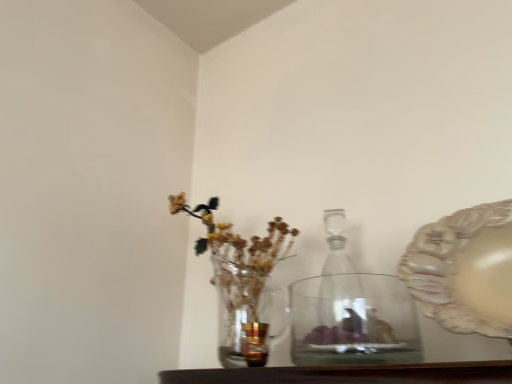
This screenshot has width=512, height=384. What do you see at coordinates (254, 343) in the screenshot?
I see `gold metallic candle holder at center` at bounding box center [254, 343].

At what (x,y) coordinates should I click in order to perform the action: click on clear glass vase at left. Please return your answer as a coordinate pair (x, y). The image size is (512, 384). Looking at the image, I should click on (242, 277).

What do you see at coordinates (343, 309) in the screenshot? I see `transparent glass bottle at center` at bounding box center [343, 309].

What is the approximate width of transparent glass bottle at center?

transparent glass bottle at center is 2.20 inches wide.

What do you see at coordinates (353, 321) in the screenshot? The image size is (512, 384). I see `transparent glass vase at center` at bounding box center [353, 321].

Locate an element on the screen. The height and width of the screenshot is (384, 512). gold metallic candle holder at center is located at coordinates (254, 343).

Are transparent glass vase at center and matte beige platter at right far apart?

No, transparent glass vase at center is in close proximity to matte beige platter at right.

Is transparent glass vase at center positioned in front of matte beige platter at right?

No.

Considering the relative sizes of transparent glass vase at center and matte beige platter at right in the image provided, is transparent glass vase at center wider than matte beige platter at right?

Correct, the width of transparent glass vase at center exceeds that of matte beige platter at right.

From the image's perspective, does gold metallic candle holder at center appear higher than matte beige platter at right?

No, from the image's perspective, gold metallic candle holder at center is not on top of matte beige platter at right.

In the scene shown: From a real-world perspective, which is physically above, gold metallic candle holder at center or matte beige platter at right?

matte beige platter at right, from a real-world perspective.

From the picture: Considering the sizes of objects gold metallic candle holder at center and matte beige platter at right in the image provided, who is thinner, gold metallic candle holder at center or matte beige platter at right?

Thinner between the two is gold metallic candle holder at center.

Are gold metallic candle holder at center and matte beige platter at right far apart?

No, gold metallic candle holder at center is not far from matte beige platter at right.

Can you confirm if transparent glass bottle at center is taller than transparent glass vase at center?

Indeed, transparent glass bottle at center has a greater height compared to transparent glass vase at center.

Based on their sizes in the image, would you say transparent glass bottle at center is bigger or smaller than transparent glass vase at center?

In the image, transparent glass bottle at center appears to be smaller than transparent glass vase at center.

Is the surface of transparent glass bottle at center in direct contact with transparent glass vase at center?

Yes, transparent glass bottle at center is beside transparent glass vase at center.

Looking at this image, which object is further away from the camera taking this photo, transparent glass bottle at center or transparent glass vase at center?

Positioned behind is transparent glass bottle at center.

From the image's perspective, would you say gold metallic candle holder at center is positioned over transparent glass bottle at center?

No.

From a real-world perspective, is gold metallic candle holder at center below transparent glass bottle at center?

Indeed, from a real-world perspective, gold metallic candle holder at center is positioned beneath transparent glass bottle at center.

Considering the relative sizes of gold metallic candle holder at center and transparent glass bottle at center in the image provided, is gold metallic candle holder at center taller than transparent glass bottle at center?

No.

Is transparent glass bottle at center wider or thinner than clear glass vase at left?

Considering their sizes, transparent glass bottle at center looks slimmer than clear glass vase at left.

Considering their positions, is transparent glass bottle at center located in front of or behind clear glass vase at left?

transparent glass bottle at center is positioned farther from the viewer than clear glass vase at left.

From a real-world perspective, relative to clear glass vase at left, is transparent glass bottle at center vertically above or below?

Clearly, from a real-world perspective, transparent glass bottle at center is below clear glass vase at left.

Is transparent glass bottle at center next to clear glass vase at left and touching it?

No, transparent glass bottle at center is not in contact with clear glass vase at left.

Does clear glass vase at left appear on the left side of transparent glass bottle at center?

Yes, clear glass vase at left is to the left of transparent glass bottle at center.

Are clear glass vase at left and transparent glass bottle at center far apart?

No.

How different are the orientations of clear glass vase at left and transparent glass bottle at center in degrees?

The angular difference between clear glass vase at left and transparent glass bottle at center is 0.57 degrees.

From a real-world perspective, between clear glass vase at left and transparent glass bottle at center, who is vertically lower?

transparent glass bottle at center, from a real-world perspective.

You are a GUI agent. You are given a task and a screenshot of the screen. Output one action in this format:
    pyautogui.click(x=<x>, y=<y>)
    Task: Click on the vase below the clear glass vase at left (from a real-world perspective)
    The width and height of the screenshot is (512, 384).
    Given the screenshot: What is the action you would take?
    pyautogui.click(x=353, y=321)

How many degrees apart are the facing directions of transparent glass vase at center and clear glass vase at left?

0.571 degrees separate the facing orientations of transparent glass vase at center and clear glass vase at left.

Considering the points (293, 303) and (271, 221), which point is behind, point (293, 303) or point (271, 221)?

Point (293, 303)

Is transparent glass vase at center looking in the opposite direction of clear glass vase at left?

No, transparent glass vase at center is not facing away from clear glass vase at left.

Where is `vase that appears below the matte beige platter at right (from a real-world perspective)`? The image size is (512, 384). vase that appears below the matte beige platter at right (from a real-world perspective) is located at coordinates (353, 321).

Where is `platter in front of the gold metallic candle holder at center`? The height and width of the screenshot is (384, 512). platter in front of the gold metallic candle holder at center is located at coordinates (464, 270).

Based on their spatial positions, is matte beige platter at right or clear glass vase at left closer to transparent glass vase at center?

clear glass vase at left.

Based on their spatial positions, is transparent glass bottle at center or matte beige platter at right further from gold metallic candle holder at center?

Based on the image, matte beige platter at right appears to be further to gold metallic candle holder at center.

Which object lies nearer to the anchor point transparent glass bottle at center, transparent glass vase at center or gold metallic candle holder at center?

transparent glass vase at center is closer to transparent glass bottle at center.

Based on their spatial positions, is clear glass vase at left or transparent glass bottle at center closer to gold metallic candle holder at center?

clear glass vase at left.

Which object lies nearer to the anchor point gold metallic candle holder at center, transparent glass vase at center or transparent glass bottle at center?

Based on the image, transparent glass vase at center appears to be nearer to gold metallic candle holder at center.

From the image, which object appears to be farther from transparent glass vase at center, clear glass vase at left or transparent glass bottle at center?

Based on the image, clear glass vase at left appears to be further to transparent glass vase at center.

Looking at this image, estimate the real-world distances between objects in this image. Which object is closer to clear glass vase at left, matte beige platter at right or gold metallic candle holder at center?

gold metallic candle holder at center.

Considering their positions, is clear glass vase at left positioned closer to gold metallic candle holder at center than transparent glass vase at center?

Among the two, clear glass vase at left is located nearer to gold metallic candle holder at center.

What are the coordinates of `candle holder between matte beige platter at right and transparent glass bottle at center along the z-axis` in the screenshot? It's located at (254, 343).

Image resolution: width=512 pixels, height=384 pixels. I want to click on vase between clear glass vase at left and transparent glass bottle at center, so click(x=353, y=321).

Locate an element on the screen. vase between matte beige platter at right and transparent glass bottle at center in the front-back direction is located at coordinates (353, 321).

Locate an element on the screen. The height and width of the screenshot is (384, 512). candle holder between transparent glass vase at center and transparent glass bottle at center in the front-back direction is located at coordinates (254, 343).